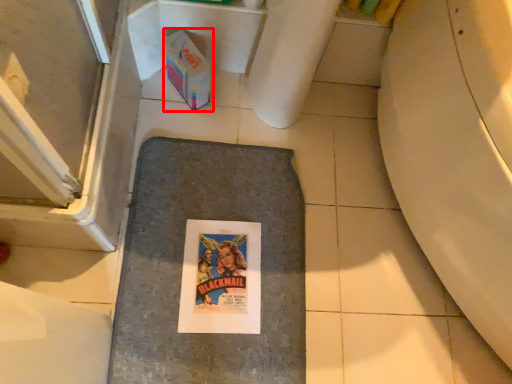
Question: From the image's perspective, considering the relative positions of cardboard box (annotated by the red box) and bath mat in the image provided, where is cardboard box (annotated by the red box) located with respect to the staircase?

Choices:
 (A) above
 (B) below

Answer: (A)